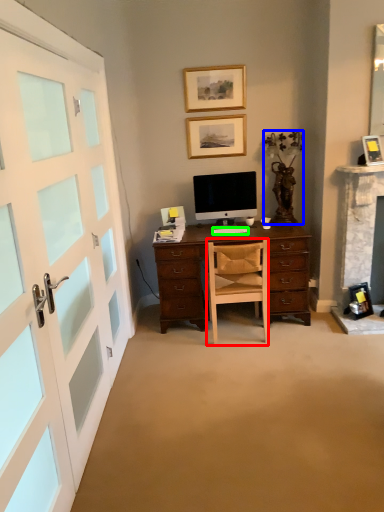
Question: Estimate the real-world distances between objects in this image. Which object is closer to chair (highlighted by a red box), houseplant (highlighted by a blue box) or computer keyboard (highlighted by a green box)?

Choices:
 (A) houseplant
 (B) computer keyboard

Answer: (B)